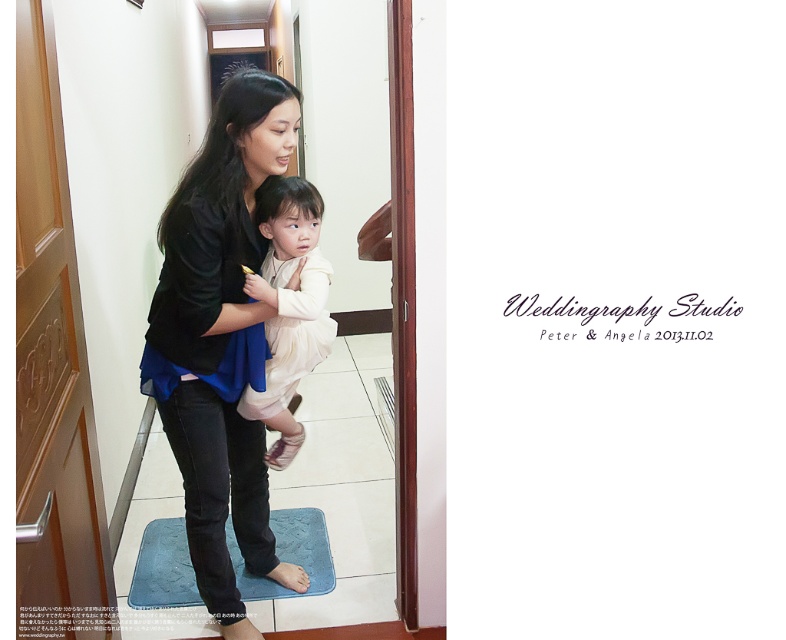
Question: Can you confirm if ivory satin dress at center is thinner than blue textured mat at lower center?

Choices:
 (A) no
 (B) yes

Answer: (B)

Question: Is black matte jacket at center below ivory satin dress at center?

Choices:
 (A) yes
 (B) no

Answer: (A)

Question: Is black matte jacket at center smaller than blue textured mat at lower center?

Choices:
 (A) yes
 (B) no

Answer: (B)

Question: Estimate the real-world distances between objects in this image. Which object is farther from the ivory satin dress at center?

Choices:
 (A) blue textured mat at lower center
 (B) black matte jacket at center

Answer: (A)

Question: Considering the real-world distances, which object is farthest from the black matte jacket at center?

Choices:
 (A) blue textured mat at lower center
 (B) ivory satin dress at center

Answer: (A)

Question: Which of the following is the farthest from the observer?

Choices:
 (A) blue textured mat at lower center
 (B) black matte jacket at center

Answer: (A)